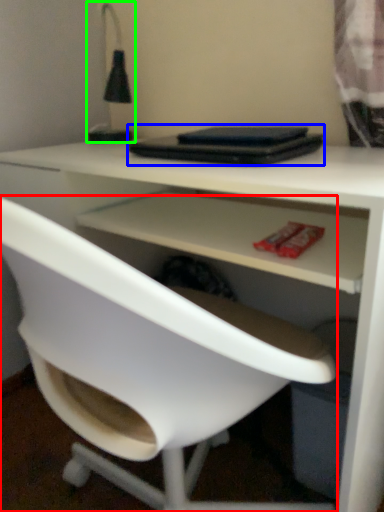
Question: Which is farther away from chair (highlighted by a red box)? laptop (highlighted by a blue box) or table lamp (highlighted by a green box)?

Choices:
 (A) laptop
 (B) table lamp

Answer: (B)